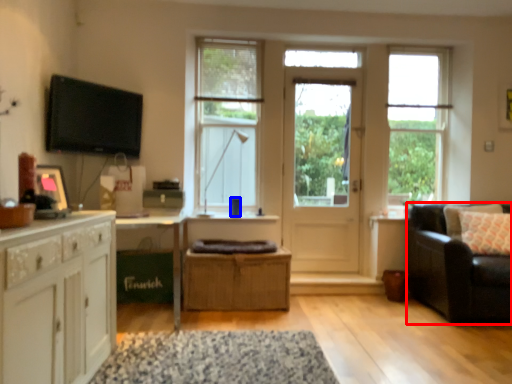
Question: Which object is further to the camera taking this photo, studio couch (highlighted by a red box) or coffee cup (highlighted by a blue box)?

Choices:
 (A) studio couch
 (B) coffee cup

Answer: (B)